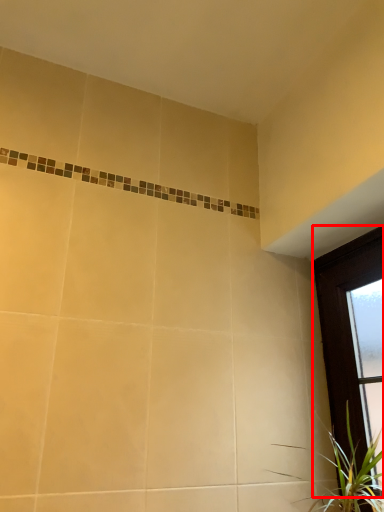
Question: Where is window (annotated by the red box) located in relation to houseplant in the image?

Choices:
 (A) left
 (B) right

Answer: (B)